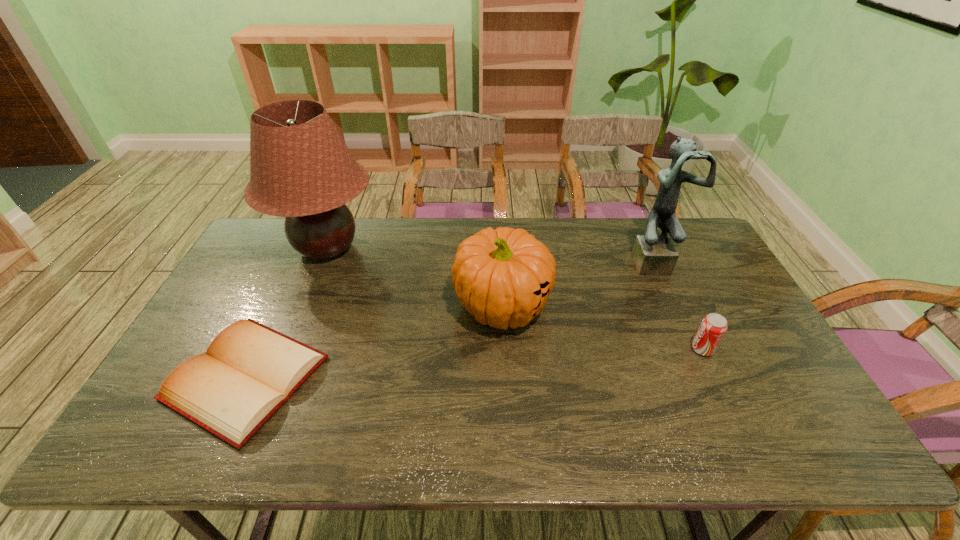
Locate an element on the screen. The image size is (960, 540). empty location between the lampshade and the pumpkin is located at coordinates (415, 277).

The height and width of the screenshot is (540, 960). What are the coordinates of `unoccupied position between the pumpkin and the soda can` in the screenshot? It's located at (602, 327).

Identify the location of empty space that is in between the fourth tallest object and the Bible. (474, 363).

Locate an element on the screen. This screenshot has height=540, width=960. vacant point located between the lampshade and the pumpkin is located at coordinates (415, 277).

This screenshot has width=960, height=540. I want to click on vacant area that lies between the sculpture and the pumpkin, so click(578, 284).

Identify the location of vacant space that's between the lampshade and the Bible. The width and height of the screenshot is (960, 540). (286, 313).

Identify which object is the fourth nearest to the sculpture. Please provide its 2D coordinates. Your answer should be formatted as a tuple, i.e. [(x, y)], where the tuple contains the x and y coordinates of a point satisfying the conditions above.

[(249, 371)]

Identify the location of the closest object to the fourth tallest object. (653, 254).

You are a GUI agent. You are given a task and a screenshot of the screen. Output one action in this format:
    pyautogui.click(x=<x>, y=<y>)
    Task: Click on the free spot that satisfies the following two spatial constraints: 1. on the logo side of the second shortest object; 2. on the front side of the Bible
    
    Given the screenshot: What is the action you would take?
    pyautogui.click(x=716, y=377)